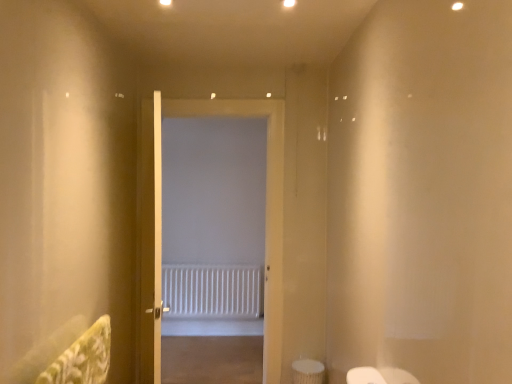
Image resolution: width=512 pixels, height=384 pixels. What do you see at coordinates (160, 220) in the screenshot?
I see `white matte door at center, the 1th door in the back-to-front sequence` at bounding box center [160, 220].

Locate an element on the screen. The height and width of the screenshot is (384, 512). white textured radiator at center is located at coordinates (213, 291).

The image size is (512, 384). I want to click on white matte door at center, which ranks as the second door in front-to-back order, so click(x=160, y=220).

From the image's perspective, which is below, white matte door at center, the 1th door in the back-to-front sequence, or white textured radiator at center?

white textured radiator at center appears lower in the image.

Is white matte door at center, the 1th door in the back-to-front sequence, with white textured radiator at center?

white matte door at center, the 1th door in the back-to-front sequence, and white textured radiator at center are clearly separated.

Which door is the 1st one when counting from the front of the white textured radiator at center? Please provide its 2D coordinates.

[(160, 220)]

Would you say white matte door at center, which ranks as the second door in front-to-back order, is outside white textured radiator at center?

Yes, white matte door at center, which ranks as the second door in front-to-back order, is located beyond the bounds of white textured radiator at center.

Looking at the image, does white matte door at center, which ranks as the second door in front-to-back order, seem bigger or smaller compared to white wooden door at center, the first door from the front?

white matte door at center, which ranks as the second door in front-to-back order, is bigger than white wooden door at center, the first door from the front.

Which object is closer to the camera, white matte door at center, which ranks as the second door in front-to-back order, or white wooden door at center, the first door from the front?

white wooden door at center, the first door from the front, is more forward.

Choose the correct answer: Is white matte door at center, the 1th door in the back-to-front sequence, inside white wooden door at center, placed as the 2th door when sorted from back to front, or outside it?

The correct answer is: outside.

From the image's perspective, relative to white wooden door at center, placed as the 2th door when sorted from back to front, is white matte door at center, which ranks as the second door in front-to-back order, above or below?

white matte door at center, which ranks as the second door in front-to-back order, is situated higher than white wooden door at center, placed as the 2th door when sorted from back to front, in the image.

Is white textured radiator at center shorter than white matte door at center, the 1th door in the back-to-front sequence?

Yes.

Could white matte door at center, which ranks as the second door in front-to-back order, be considered to be inside white textured radiator at center?

No, white matte door at center, which ranks as the second door in front-to-back order, is located outside of white textured radiator at center.

From the image's perspective, is white textured radiator at center located above white matte door at center, the 1th door in the back-to-front sequence?

No, from the image's perspective, white textured radiator at center is not above white matte door at center, the 1th door in the back-to-front sequence.

Which object is closer to the camera, white textured radiator at center or white matte door at center, which ranks as the second door in front-to-back order?

white matte door at center, which ranks as the second door in front-to-back order, is closer to the camera.

Does white textured radiator at center have a lesser height compared to white wooden door at center, placed as the 2th door when sorted from back to front?

Indeed, white textured radiator at center has a lesser height compared to white wooden door at center, placed as the 2th door when sorted from back to front.

From a real-world perspective, is white textured radiator at center on white wooden door at center, placed as the 2th door when sorted from back to front?

Actually, white textured radiator at center is physically below white wooden door at center, placed as the 2th door when sorted from back to front, in the real world.

Can you confirm if white textured radiator at center is smaller than white wooden door at center, placed as the 2th door when sorted from back to front?

Correct, white textured radiator at center occupies less space than white wooden door at center, placed as the 2th door when sorted from back to front.

Which of these two, white textured radiator at center or white wooden door at center, placed as the 2th door when sorted from back to front, is thinner?

Thinner between the two is white textured radiator at center.

Consider the image. Considering the sizes of objects white wooden door at center, placed as the 2th door when sorted from back to front, and white matte door at center, which ranks as the second door in front-to-back order, in the image provided, who is wider, white wooden door at center, placed as the 2th door when sorted from back to front, or white matte door at center, which ranks as the second door in front-to-back order,?

white matte door at center, which ranks as the second door in front-to-back order, is wider.

Considering the positions of objects white wooden door at center, the first door from the front, and white matte door at center, the 1th door in the back-to-front sequence, in the image provided, who is in front, white wooden door at center, the first door from the front, or white matte door at center, the 1th door in the back-to-front sequence,?

Positioned in front is white wooden door at center, the first door from the front.

From a real-world perspective, who is located lower, white wooden door at center, the first door from the front, or white matte door at center, the 1th door in the back-to-front sequence?

white wooden door at center, the first door from the front, is physically lower.

How distant is white wooden door at center, placed as the 2th door when sorted from back to front, from white textured radiator at center?

white wooden door at center, placed as the 2th door when sorted from back to front, is 1.28 meters from white textured radiator at center.

Which of these two, white wooden door at center, placed as the 2th door when sorted from back to front, or white textured radiator at center, is wider?

Wider between the two is white wooden door at center, placed as the 2th door when sorted from back to front.

Is the position of white wooden door at center, the first door from the front, more distant than that of white textured radiator at center?

No, white wooden door at center, the first door from the front, is closer to the camera.

From the white textured radiator at center, count 1st doors forward and point to it. Please provide its 2D coordinates.

[(160, 220)]

Find the location of a particular element. Image resolution: width=512 pixels, height=384 pixels. door positioned vertically above the white wooden door at center, placed as the 2th door when sorted from back to front (from a real-world perspective) is located at coordinates (160, 220).

Estimate the real-world distances between objects in this image. Which object is further from white matte door at center, which ranks as the second door in front-to-back order, white wooden door at center, placed as the 2th door when sorted from back to front, or white textured radiator at center?

Among the two, white textured radiator at center is located further to white matte door at center, which ranks as the second door in front-to-back order.

Based on their spatial positions, is white wooden door at center, placed as the 2th door when sorted from back to front, or white matte door at center, the 1th door in the back-to-front sequence, further from white textured radiator at center?

Based on the image, white wooden door at center, placed as the 2th door when sorted from back to front, appears to be further to white textured radiator at center.

When comparing their distances from white wooden door at center, the first door from the front, does white matte door at center, which ranks as the second door in front-to-back order, or white textured radiator at center seem further?

white textured radiator at center lies further to white wooden door at center, the first door from the front, than the other object.

Based on their spatial positions, is white textured radiator at center or white matte door at center, the 1th door in the back-to-front sequence, further from white wooden door at center, the first door from the front?

white textured radiator at center.

Looking at the image, which one is located closer to white matte door at center, the 1th door in the back-to-front sequence, white textured radiator at center or white wooden door at center, the first door from the front?

white wooden door at center, the first door from the front, is closer to white matte door at center, the 1th door in the back-to-front sequence.

Based on their spatial positions, is white matte door at center, which ranks as the second door in front-to-back order, or white wooden door at center, the first door from the front, closer to white textured radiator at center?

white matte door at center, which ranks as the second door in front-to-back order, is positioned closer to the anchor white textured radiator at center.

Identify the location of door located between white wooden door at center, placed as the 2th door when sorted from back to front, and white textured radiator at center in the depth direction. (160, 220).